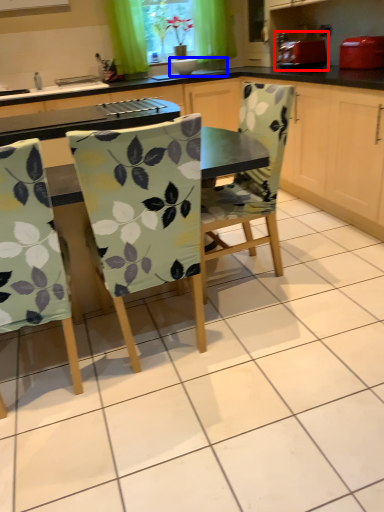
Question: Among these objects, which one is farthest to the camera, appliance (highlighted by a red box) or sink (highlighted by a blue box)?

Choices:
 (A) appliance
 (B) sink

Answer: (B)